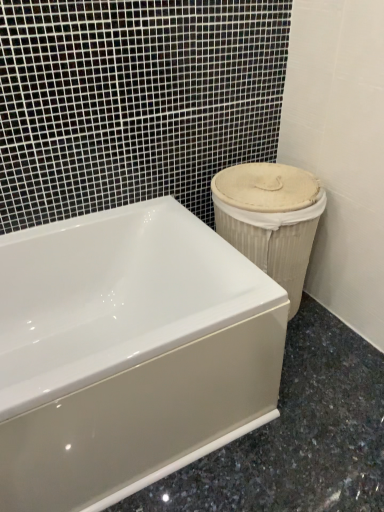
Find the location of a particular element. The image size is (384, 512). free point above beige woven basket at right (from a real-world perspective) is located at coordinates [x=271, y=175].